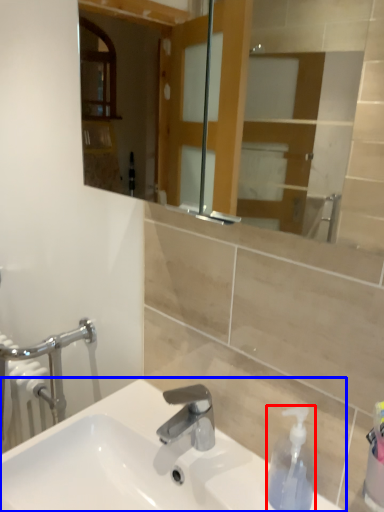
Question: Which point is closer to the camera, soap dispenser (highlighted by a red box) or sink (highlighted by a blue box)?

Choices:
 (A) soap dispenser
 (B) sink

Answer: (B)